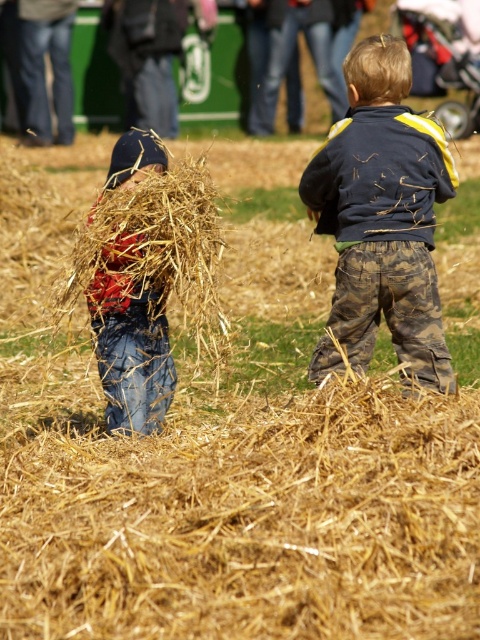
Question: Can you confirm if camouflage pants at center is wider than denim jeans at left?

Choices:
 (A) yes
 (B) no

Answer: (A)

Question: Is camouflage pants at center positioned in front of denim jeans at left?

Choices:
 (A) yes
 (B) no

Answer: (B)

Question: Can you confirm if camouflage pants at center is positioned to the left of denim jeans at left?

Choices:
 (A) no
 (B) yes

Answer: (A)

Question: Among these objects, which one is nearest to the camera?

Choices:
 (A) denim jeans at left
 (B) camouflage pants at center

Answer: (A)

Question: Which point is farther to the camera?

Choices:
 (A) (168, 371)
 (B) (432, 204)

Answer: (A)